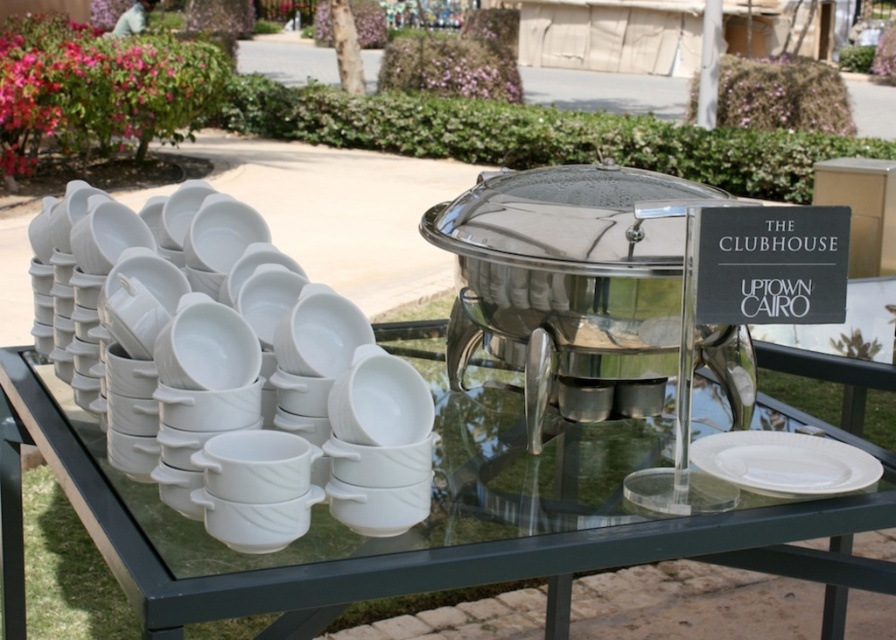
Which is below, white glossy plate at left or transparent glass table at center?

Positioned lower is transparent glass table at center.

Looking at this image, between white glossy plate at left and transparent glass table at center, which one is positioned higher?

white glossy plate at left

Who is more forward, [314,410] or [592,564]?

Positioned in front is point [592,564].

Image resolution: width=896 pixels, height=640 pixels. In order to click on white glossy plate at left in this screenshot , I will do `click(246, 388)`.

Who is positioned more to the left, white glossy plate at left or white matte plate at center?

white glossy plate at left

Identify the location of white glossy plate at left. The height and width of the screenshot is (640, 896). (246, 388).

Is point (268, 368) in front of point (791, 483)?

No, (268, 368) is further to viewer.

Image resolution: width=896 pixels, height=640 pixels. I want to click on white glossy plate at left, so 246,388.

Does transparent glass table at center have a lesser height compared to white matte plate at center?

In fact, transparent glass table at center may be taller than white matte plate at center.

Is transparent glass table at center below white matte plate at center?

Yes.

Describe the element at coordinates (437, 547) in the screenshot. This screenshot has height=640, width=896. I see `transparent glass table at center` at that location.

What are the coordinates of `transparent glass table at center` in the screenshot? It's located at (437, 547).